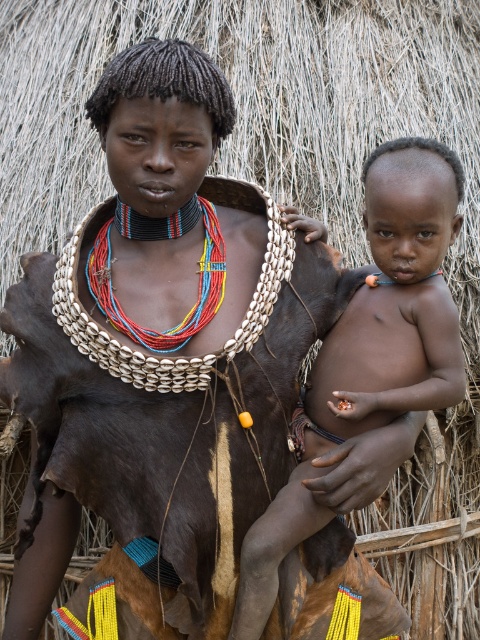
Who is positioned more to the left, matte skin baby at center or multicolored beaded necklace at center?

From the viewer's perspective, multicolored beaded necklace at center appears more on the left side.

Does matte skin baby at center appear on the right side of multicolored beaded necklace at center?

Yes, matte skin baby at center is to the right of multicolored beaded necklace at center.

Does point (350, 385) come farther from viewer compared to point (170, 333)?

Yes, point (350, 385) is behind point (170, 333).

The image size is (480, 640). I want to click on matte skin baby at center, so click(371, 349).